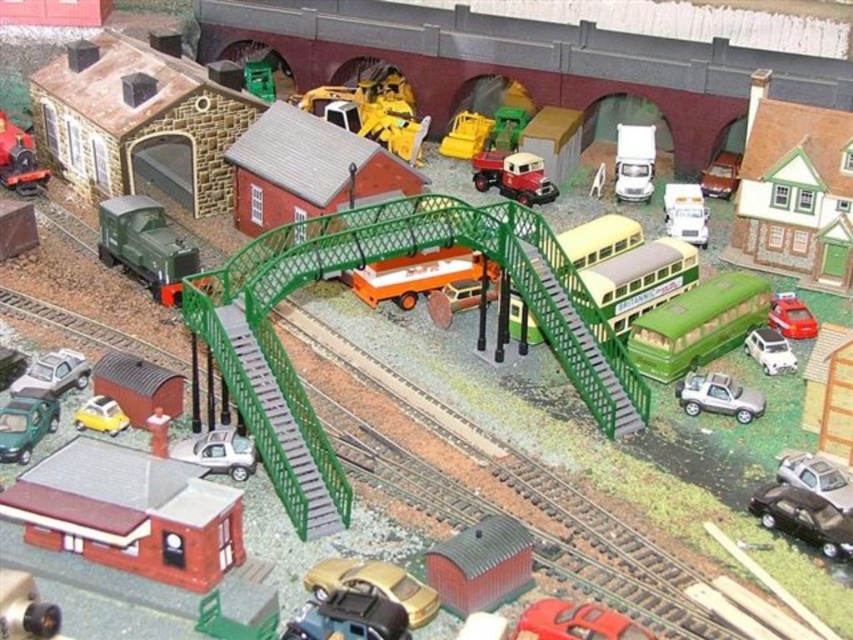
You are a miniature figure standing at the base of the pedestrian bridge. You need to reach the red roofed building to your left. Which direction should you go relative to the brown matte train car at lower left and the satin silver car at lower left?

You should go to the left of the brown matte train car at lower left because it is positioned to the left of the satin silver car at lower left, and the red roofed building is also to the left.